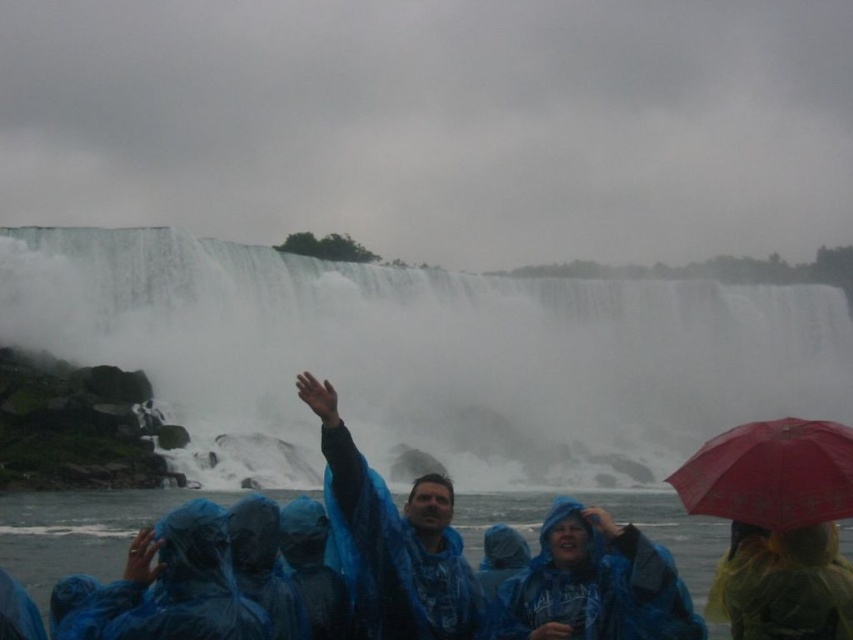
Question: Does blue waterproof jacket at lower center appear over yellow translucent raincoat at lower right?

Choices:
 (A) yes
 (B) no

Answer: (A)

Question: Where is blue waterproof jacket at center located in relation to blue waterproof poncho at lower left in the image?

Choices:
 (A) above
 (B) below

Answer: (A)

Question: Which object is positioned closest to the yellow translucent raincoat at lower right?

Choices:
 (A) white misty waterfall at upper center
 (B) red matte umbrella at lower right
 (C) blue waterproof poncho at lower left
 (D) transparent blue raincoats at lower center

Answer: (B)

Question: Does blue waterproof jacket at center appear under red matte umbrella at lower right?

Choices:
 (A) no
 (B) yes

Answer: (B)

Question: Which object is the farthest from the blue waterproof jacket at center?

Choices:
 (A) blue waterproof poncho at lower left
 (B) transparent blue raincoats at lower center

Answer: (B)

Question: Which point appears closest to the camera in this image?

Choices:
 (A) (22, 506)
 (B) (747, 472)

Answer: (B)